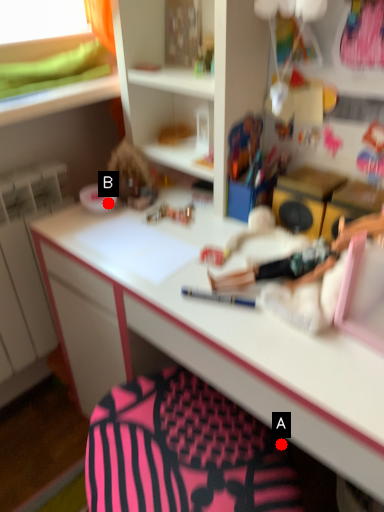
Question: Two points are circled on the image, labeled by A and B beside each circle. Which point appears closest to the camera in this image?

Choices:
 (A) A is closer
 (B) B is closer

Answer: (A)